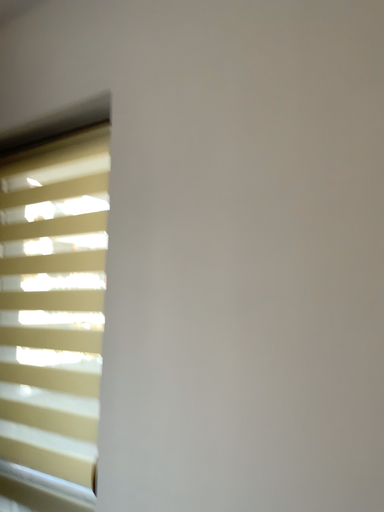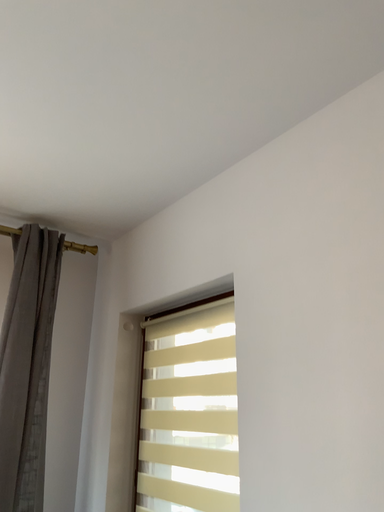
Question: How did the camera likely rotate when shooting the video?

Choices:
 (A) rotated downward
 (B) rotated upward

Answer: (B)